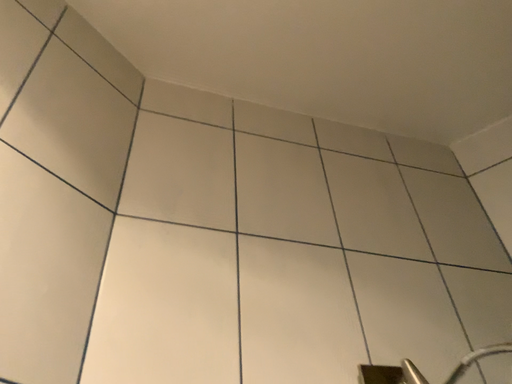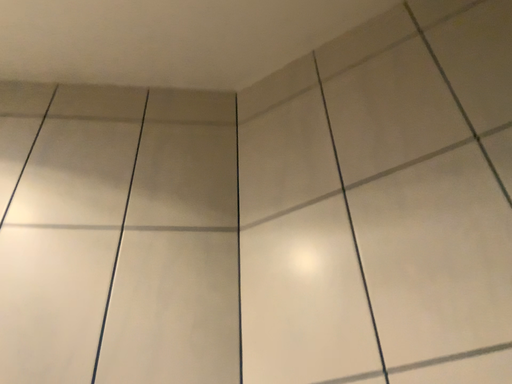
Question: How did the camera likely rotate when shooting the video?

Choices:
 (A) rotated upward
 (B) rotated downward

Answer: (B)